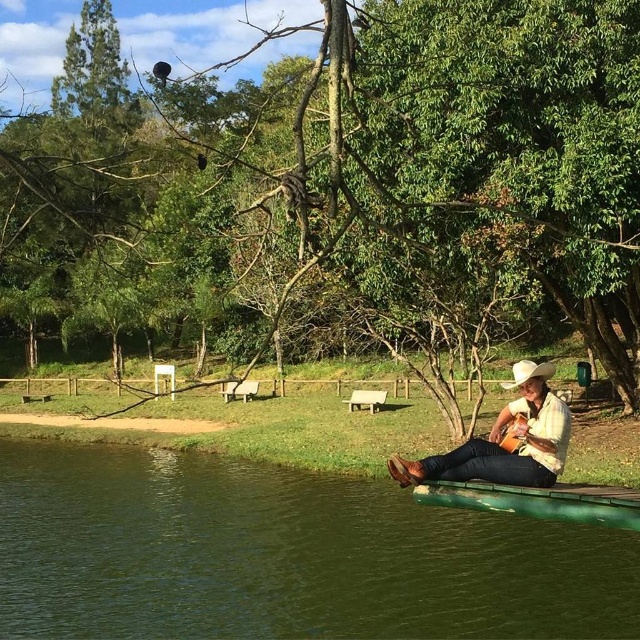
You are planning to take a boat ride on the lake and see the green rubber raft at lower right and the green rubber canoe at lower center. Which one is positioned closer to the left side of the scene?

The green rubber raft at lower right is to the left of the green rubber canoe at lower center, so it is positioned closer to the left side of the scene.

You are a photographer trying to capture the leather cowboy hat at center and the green rubber canoe at lower center in the same frame. Which object should you adjust your camera to focus on first if you want to include both in your shot?

The leather cowboy hat at center is positioned on the right side of green rubber canoe at lower center, so you should focus on the green rubber canoe at lower center first as it is closer to the center of the image and the hat is to its right.

You are planning to take a short trip on the water in this scene. You want to choose between the green rubber raft at lower right and the green rubber canoe at lower center. Which one can carry more passengers?

The green rubber raft at lower right has a larger size compared to the green rubber canoe at lower center, so it can carry more passengers.